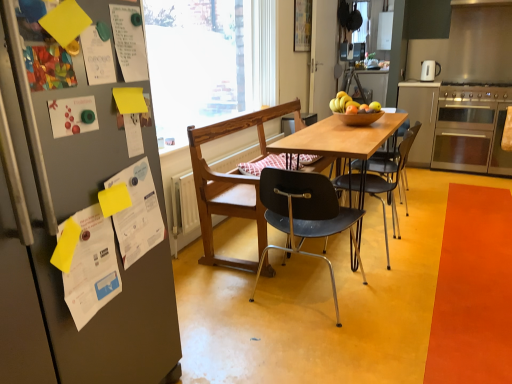
Image resolution: width=512 pixels, height=384 pixels. In order to click on free spot in front of wooden chair at center, the second chair when ordered from front to back in this screenshot , I will do pos(326,324).